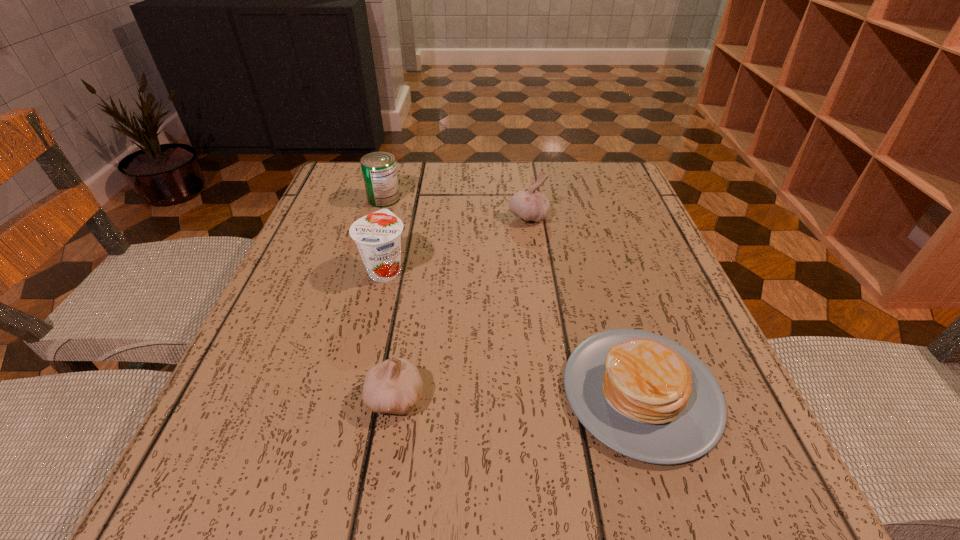
Where is `free space that satisfies the following two spatial constraints: 1. on the front side of the pancake; 2. on the right side of the third farthest object`? The image size is (960, 540). free space that satisfies the following two spatial constraints: 1. on the front side of the pancake; 2. on the right side of the third farthest object is located at coordinates (355, 393).

The image size is (960, 540). Identify the location of vacant space that satisfies the following two spatial constraints: 1. on the front side of the shortest object; 2. on the left side of the third farthest object. (355, 393).